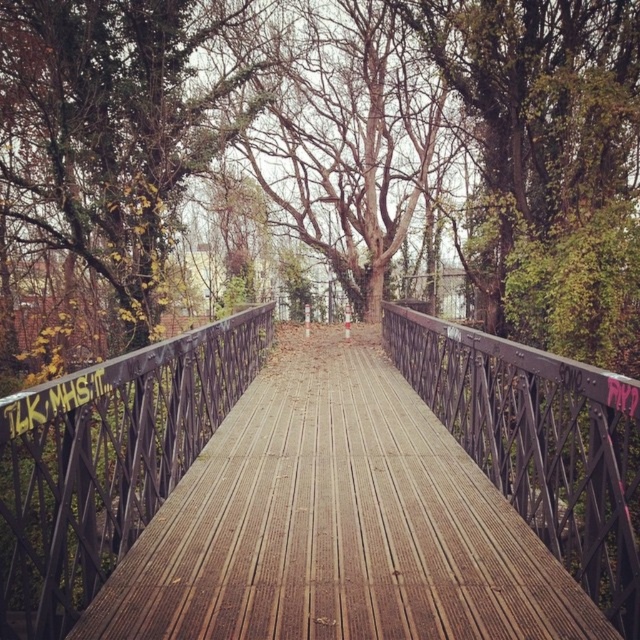
Which is behind, point (204, 20) or point (509, 419)?

Positioned behind is point (204, 20).

Between point (64, 35) and point (624, 476), which one is positioned behind?

Point (64, 35)

Where is `green ivy-covered tree at upper left`? The image size is (640, 640). green ivy-covered tree at upper left is located at coordinates (109, 131).

Who is more forward, (196, 93) or (100, 563)?

Positioned in front is point (100, 563).

Is green ivy-covered tree at upper left smaller than metallic black railing at center?

Incorrect, green ivy-covered tree at upper left is not smaller in size than metallic black railing at center.

Where is `green ivy-covered tree at upper left`? green ivy-covered tree at upper left is located at coordinates (109, 131).

Does wooden planks at center have a lesser width compared to metallic black railing at center?

In fact, wooden planks at center might be wider than metallic black railing at center.

Who is more forward, (188, 589) or (38, 554)?

Point (188, 589) is in front.

The height and width of the screenshot is (640, 640). In order to click on wooden planks at center in this screenshot , I will do `click(337, 524)`.